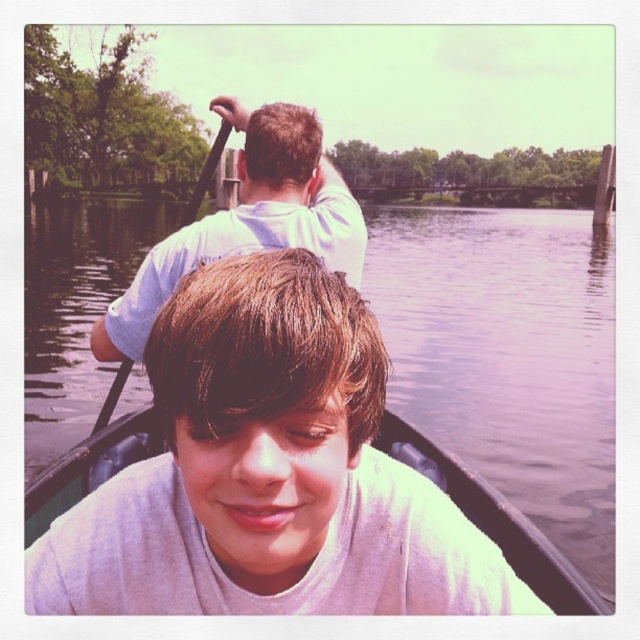
You are a photographer trying to capture a clear image of the white cotton shirt at upper center and the black wood paddle at upper center. Which object should you focus on first if you want to ensure both are in focus, considering their sizes?

The white cotton shirt at upper center is thinner than the black wood paddle at upper center, so you should focus on the black wood paddle at upper center first because larger objects often require more precise focusing to ensure clarity.